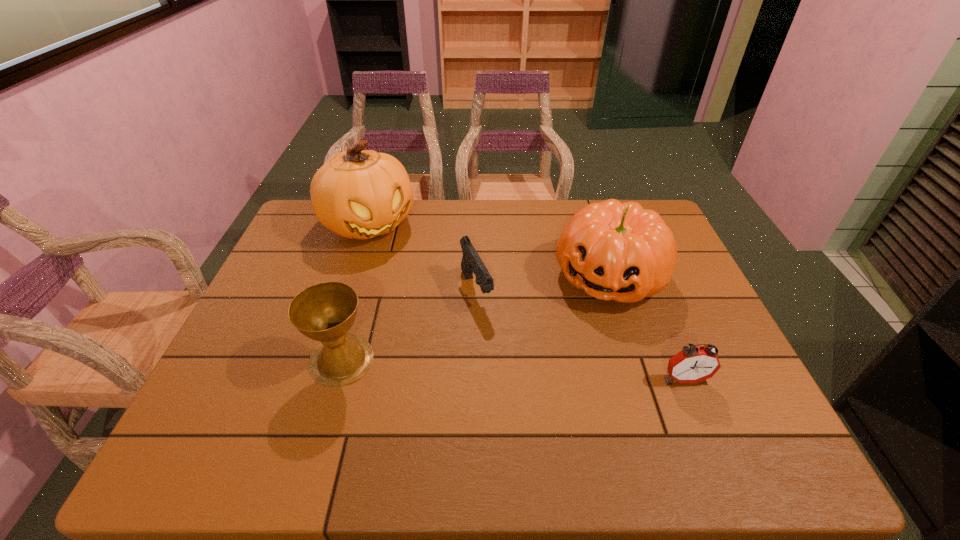
This screenshot has width=960, height=540. I want to click on free space that satisfies the following two spatial constraints: 1. on the front side of the left pumpkin; 2. on the left side of the third object from right to left, so [348, 291].

Locate an element on the screen. The image size is (960, 540). vacant position in the image that satisfies the following two spatial constraints: 1. on the back side of the chalice; 2. on the right side of the third object from left to right is located at coordinates (361, 291).